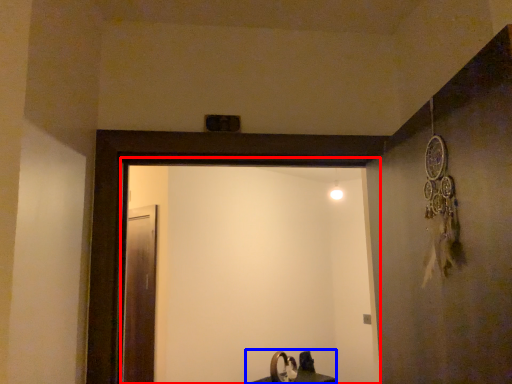
Question: Which point is further to the camera, screen door (highlighted by a red box) or sink (highlighted by a blue box)?

Choices:
 (A) screen door
 (B) sink

Answer: (B)